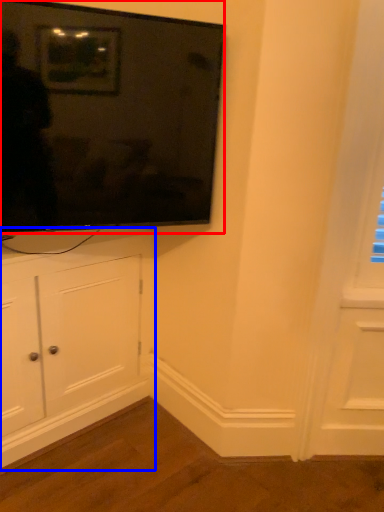
Question: Which of the following is the farthest to the observer, television (highlighted by a red box) or cabinetry (highlighted by a blue box)?

Choices:
 (A) television
 (B) cabinetry

Answer: (B)